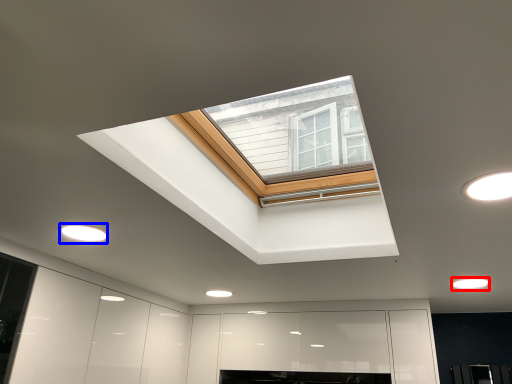
Question: Which of the following is the closest to the observer, lighting (highlighted by a red box) or lighting (highlighted by a blue box)?

Choices:
 (A) lighting
 (B) lighting

Answer: (B)